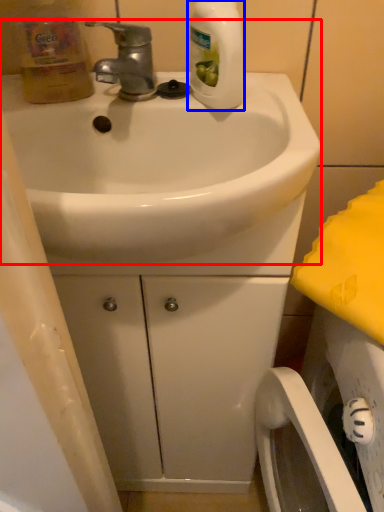
Question: Which of the following is the farthest to the observer, sink (highlighted by a red box) or cleaning product (highlighted by a blue box)?

Choices:
 (A) sink
 (B) cleaning product

Answer: (B)